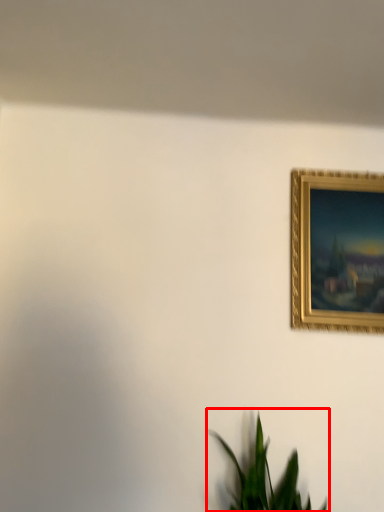
Question: In this image, where is houseplant (annotated by the red box) located relative to picture frame?

Choices:
 (A) left
 (B) right

Answer: (A)